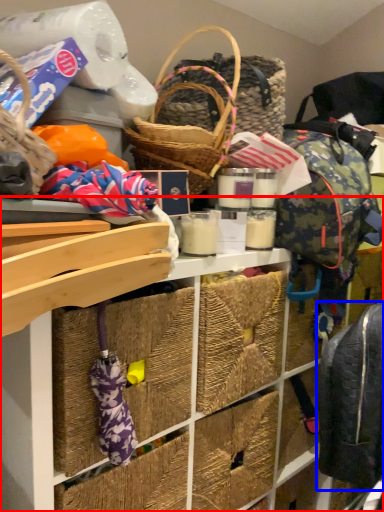
Question: Which object is further to the camera taking this photo, shelf (highlighted by a red box) or backpack (highlighted by a blue box)?

Choices:
 (A) shelf
 (B) backpack

Answer: (B)